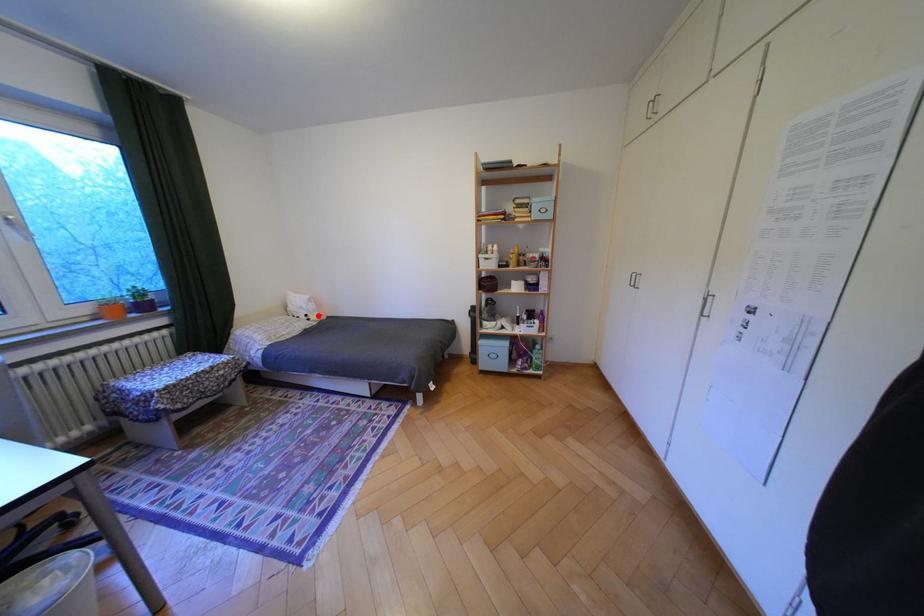
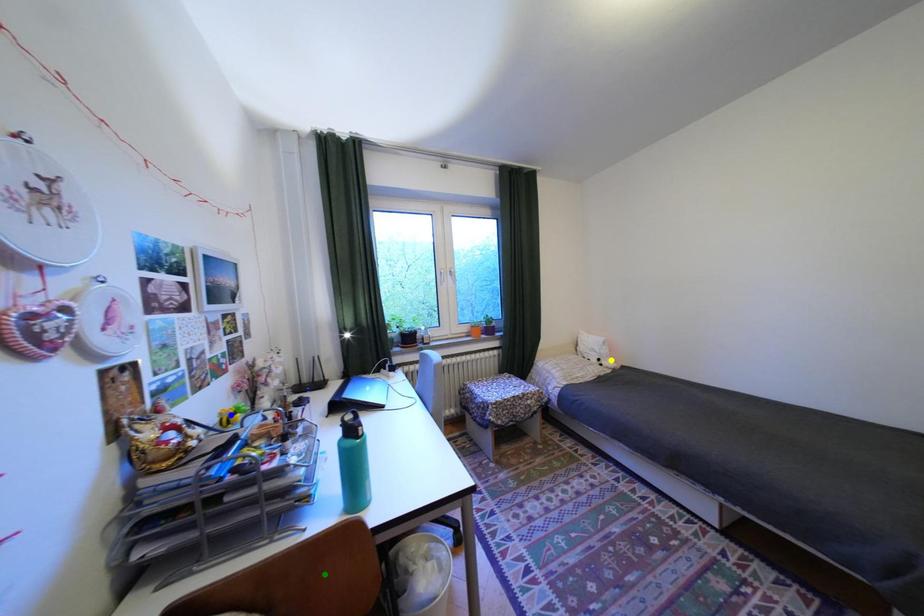
Question: I am providing you with two images of the same scene from different viewpoints. A red point is marked on the first image. You are given multiple points on the second image. Which spot in image 2 lines up with the point in image 1?

Choices:
 (A) yellow point
 (B) blue point
 (C) green point

Answer: (A)